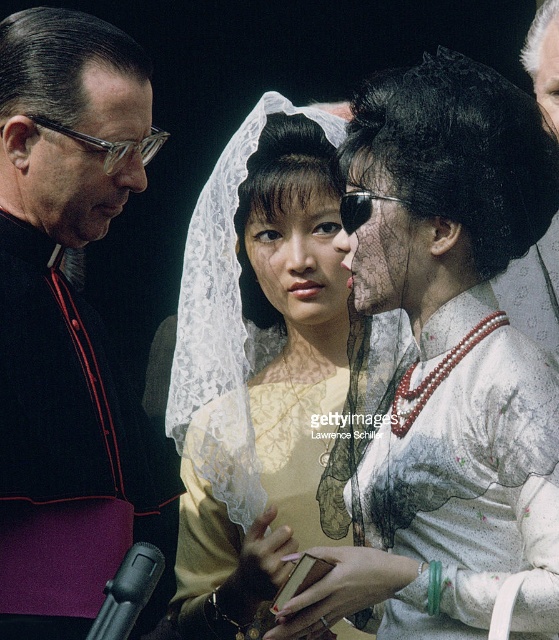
Question: Can you confirm if white sheer fabric robe at center is positioned below black velvet robe at left?

Choices:
 (A) no
 (B) yes

Answer: (B)

Question: Which point appears closest to the camera in this image?

Choices:
 (A) (67, 356)
 (B) (538, 268)
 (C) (186, 349)
 (D) (487, 333)

Answer: (D)

Question: From the image, what is the correct spatial relationship of black velvet robe at left in relation to gray velvet hat at upper right?

Choices:
 (A) below
 (B) above

Answer: (A)

Question: Among these points, which one is farthest from the camera?

Choices:
 (A) (529, 532)
 (B) (89, 81)
 (C) (551, 40)
 (D) (198, 468)

Answer: (D)

Question: Which object appears closest to the camera in this image?

Choices:
 (A) matte yellow lace veil at center
 (B) white sheer fabric robe at center

Answer: (B)

Question: Is white sheer fabric robe at center further to the viewer compared to gray velvet hat at upper right?

Choices:
 (A) yes
 (B) no

Answer: (B)